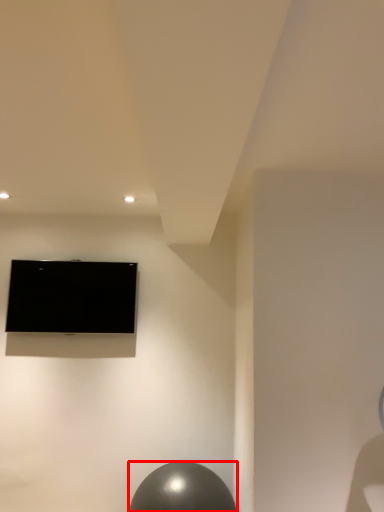
Question: From the image's perspective, where is ball (annotated by the red box) located relative to television?

Choices:
 (A) above
 (B) below

Answer: (B)